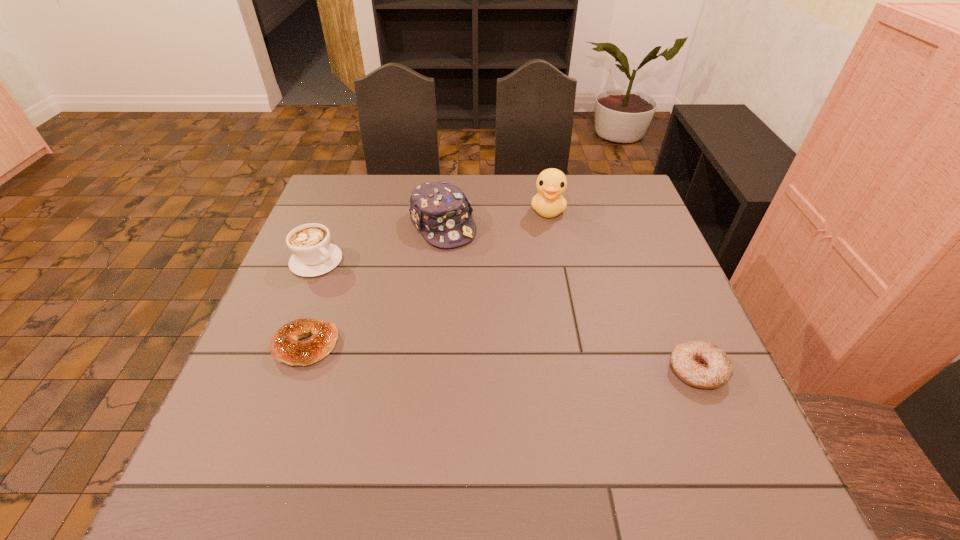
Locate an element on the screen. The width and height of the screenshot is (960, 540). free space between the bagel and the cappuccino is located at coordinates (311, 303).

Where is `vacant space in between the tallest object and the shortest object`? vacant space in between the tallest object and the shortest object is located at coordinates (427, 278).

Where is `free space between the second tallest object and the bagel`? free space between the second tallest object and the bagel is located at coordinates (374, 286).

Locate an element on the screen. free spot between the cappuccino and the fourth shortest object is located at coordinates (379, 243).

I want to click on free spot between the bagel and the headwear, so click(x=374, y=286).

Where is `empty location between the cappuccino and the rightmost object`? The image size is (960, 540). empty location between the cappuccino and the rightmost object is located at coordinates pos(507,316).

Point out which object is positioned as the fourth nearest to the headwear. Please provide its 2D coordinates. Your answer should be formatted as a tuple, i.e. [(x, y)], where the tuple contains the x and y coordinates of a point satisfying the conditions above.

[(701, 364)]

Choose which object is the third nearest neighbor to the bagel. Please provide its 2D coordinates. Your answer should be formatted as a tuple, i.e. [(x, y)], where the tuple contains the x and y coordinates of a point satisfying the conditions above.

[(551, 183)]

You are a GUI agent. You are given a task and a screenshot of the screen. Output one action in this format:
    pyautogui.click(x=<x>, y=<y>)
    Task: Click on the free region that satisfies the following two spatial constraints: 1. on the back side of the shortest object; 2. on the right side of the headwear
    The image size is (960, 540).
    Given the screenshot: What is the action you would take?
    pyautogui.click(x=348, y=225)

Image resolution: width=960 pixels, height=540 pixels. I want to click on vacant space that satisfies the following two spatial constraints: 1. on the front side of the bagel; 2. on the left side of the cappuccino, so click(x=282, y=346).